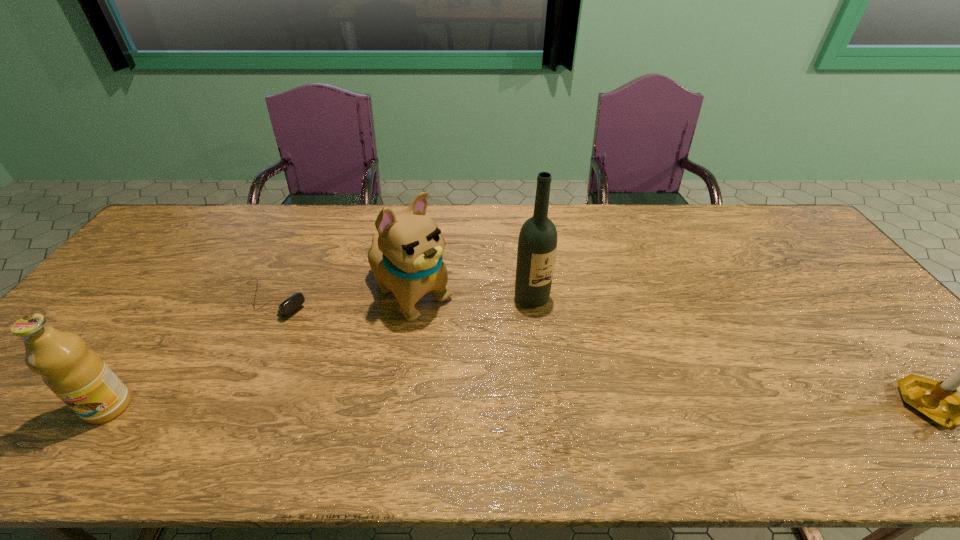
Find the location of a particular element. The image size is (960, 540). vacant spot on the desktop that is between the third tallest object and the candle holder and is positioned on the labeled side of the wine bottle is located at coordinates (612, 407).

Identify the location of free space on the desktop that is between the third tallest object and the second shortest object and is positioned on the front-facing side of the second object from left to right. (445, 407).

Where is `vacant space on the desktop that is between the third shortest object and the candle holder and is positioned on the face of the fourth shortest object`? The width and height of the screenshot is (960, 540). vacant space on the desktop that is between the third shortest object and the candle holder and is positioned on the face of the fourth shortest object is located at coordinates (543, 407).